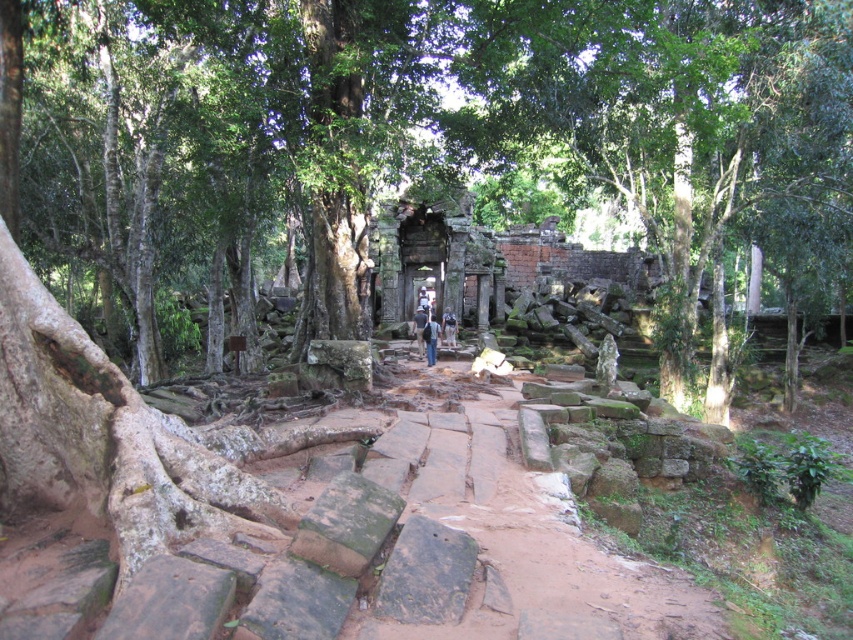
Which is in front, point (416, 316) or point (451, 316)?

Point (451, 316) is more forward.

Is brown leather backpack at center to the right of blue fabric shirt at center from the viewer's perspective?

Incorrect, brown leather backpack at center is not on the right side of blue fabric shirt at center.

The height and width of the screenshot is (640, 853). What do you see at coordinates (419, 326) in the screenshot? I see `brown leather backpack at center` at bounding box center [419, 326].

I want to click on brown leather backpack at center, so click(x=419, y=326).

Does dark blue jeans at center have a lesser width compared to brown leather backpack at center?

Yes.

Between dark blue jeans at center and brown leather backpack at center, which one has more height?

With more height is brown leather backpack at center.

Is point (427, 340) closer to camera compared to point (418, 316)?

Yes, it is in front of point (418, 316).

Find the location of `dark blue jeans at center`. dark blue jeans at center is located at coordinates (430, 339).

Is green rough bark tree at center taller than blue fabric shirt at center?

Yes.

Which is in front, point (390, 180) or point (451, 342)?

Positioned in front is point (390, 180).

At what (x,y) coordinates should I click in order to perform the action: click on green rough bark tree at center. Please return your answer as a coordinate pair (x, y). The image size is (853, 640). Looking at the image, I should click on (434, 128).